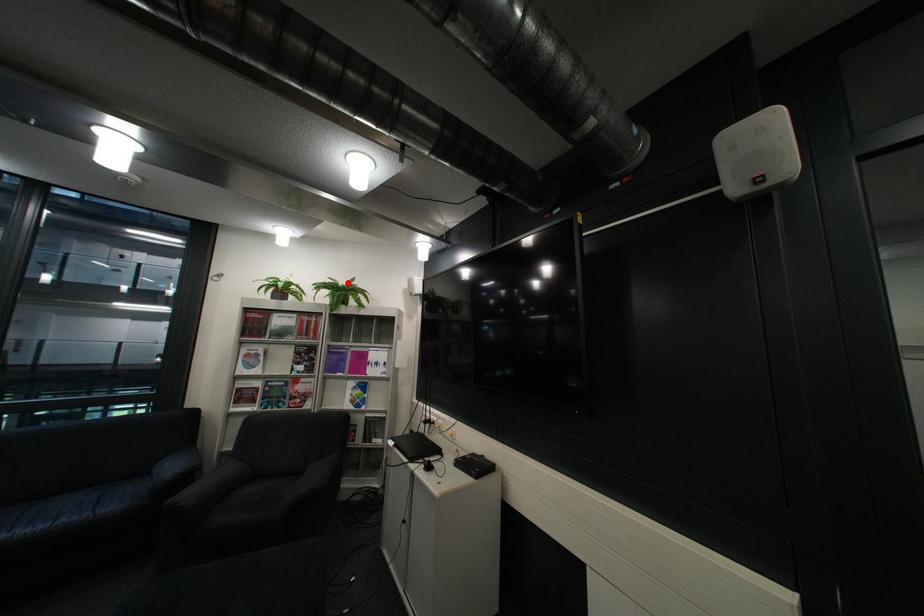
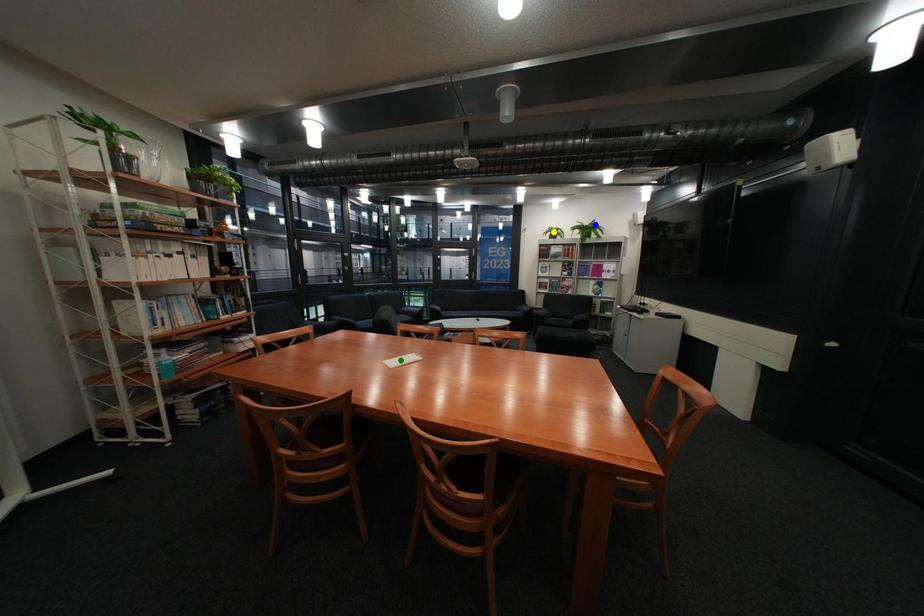
Question: I am providing you with two images of the same scene from different viewpoints. A red point is marked on the first image. You are given multiple points on the second image. In image 2, which mark is for the same physical point as the one in image 1?

Choices:
 (A) green point
 (B) yellow point
 (C) blue point

Answer: (C)